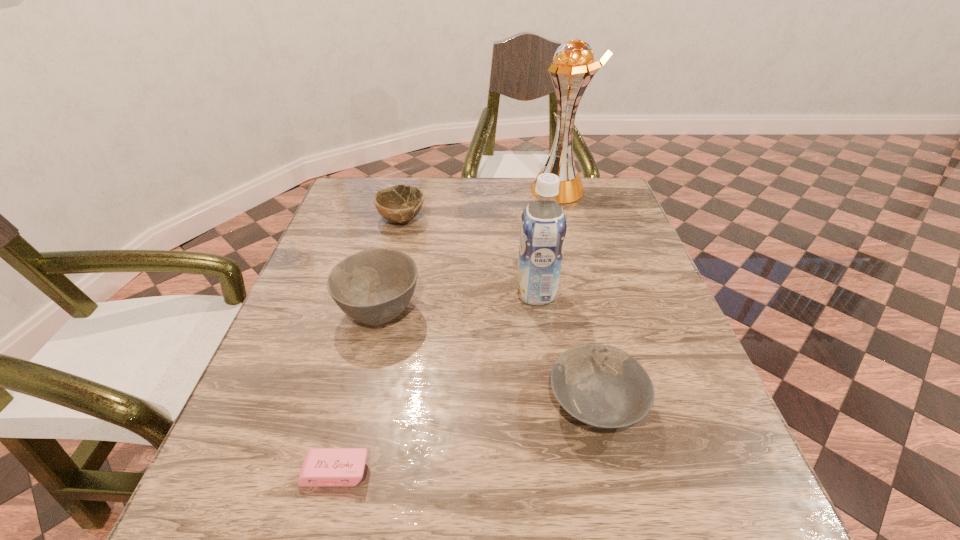
Where is `free location that satisfies the following two spatial constraints: 1. on the front side of the second nearest object; 2. on the right side of the tallest bowl`? This screenshot has height=540, width=960. free location that satisfies the following two spatial constraints: 1. on the front side of the second nearest object; 2. on the right side of the tallest bowl is located at coordinates (358, 403).